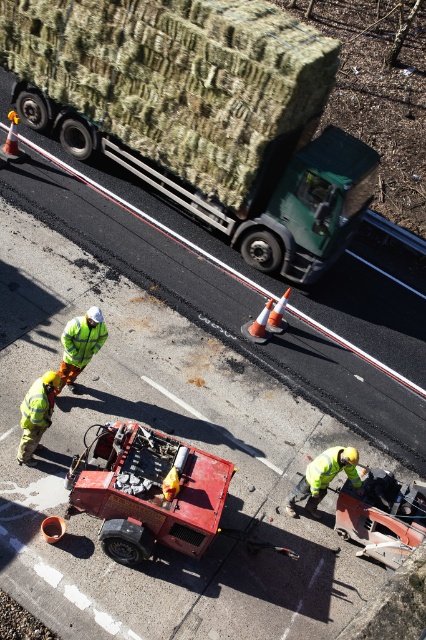
You are a delivery person who needs to locate the high visibility yellow jacket at lower right in the image. According to the coordinates provided, where exactly should you look to find it?

The high visibility yellow jacket at lower right is located at the coordinates point [324,477].

You are a pedestrian trying to cross the road and see two workers wearing jackets. One is wearing a high visibility yellow jacket at lower right and the other a high visibility reflective jacket at center. Which worker is positioned more to your right side?

The high visibility yellow jacket at lower right is positioned to the right of the high visibility reflective jacket at center, so the worker in the high visibility yellow jacket at lower right is more to your right side.